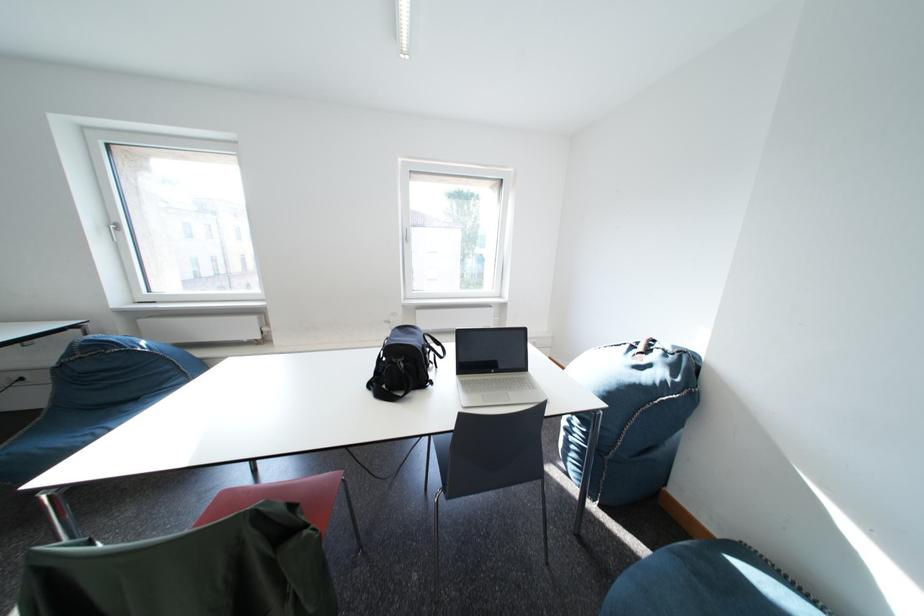
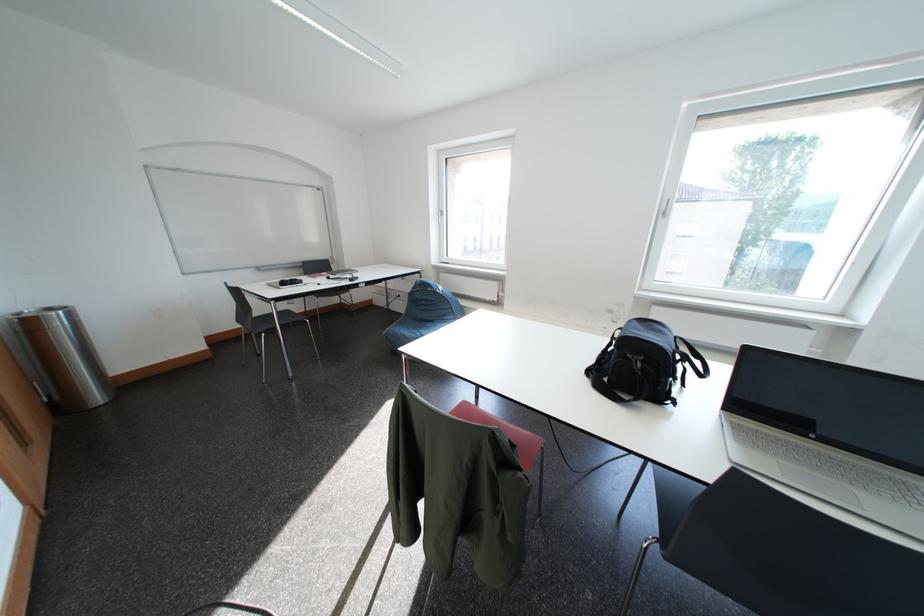
Locate, in the second image, the point that corresponds to (305,509) in the first image.

(525, 450)